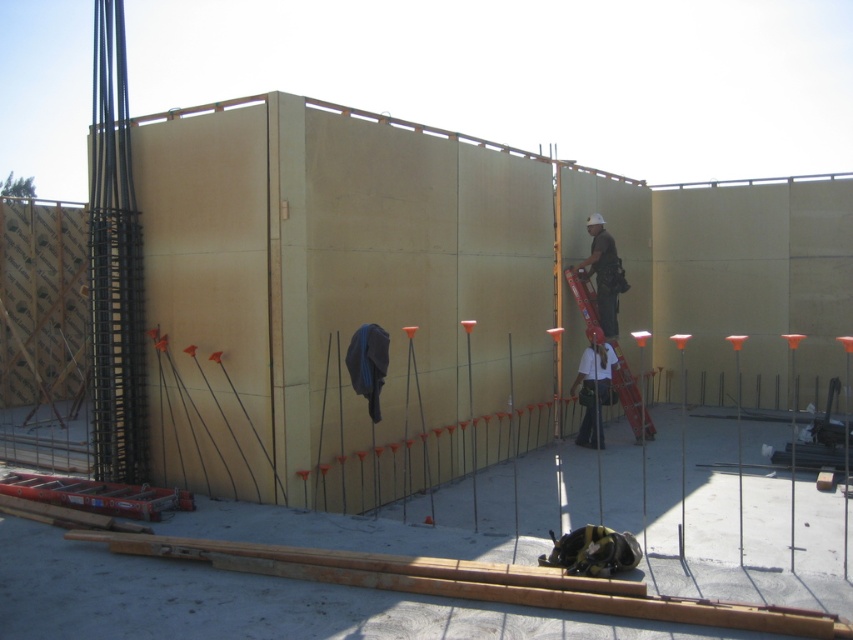
Between white fabric construction worker at center and matte white helmet at center, which one is positioned lower?

white fabric construction worker at center is below.

Does white fabric construction worker at center appear over matte white helmet at center?

Incorrect, white fabric construction worker at center is not positioned above matte white helmet at center.

Does point (585, 413) lie behind point (619, 266)?

No, (585, 413) is in front of (619, 266).

This screenshot has height=640, width=853. In order to click on white fabric construction worker at center in this screenshot , I will do `click(593, 388)`.

Between white fabric construction worker at center and metallic red ladder at center, which one has more height?

metallic red ladder at center is taller.

The width and height of the screenshot is (853, 640). What do you see at coordinates (593, 388) in the screenshot?
I see `white fabric construction worker at center` at bounding box center [593, 388].

Find the location of a particular element. The image size is (853, 640). white fabric construction worker at center is located at coordinates (593, 388).

Between metallic red ladder at center and matte white helmet at center, which one appears on the left side from the viewer's perspective?

Positioned to the left is metallic red ladder at center.

Does metallic red ladder at center have a lesser width compared to matte white helmet at center?

No.

The image size is (853, 640). Identify the location of metallic red ladder at center. (630, 394).